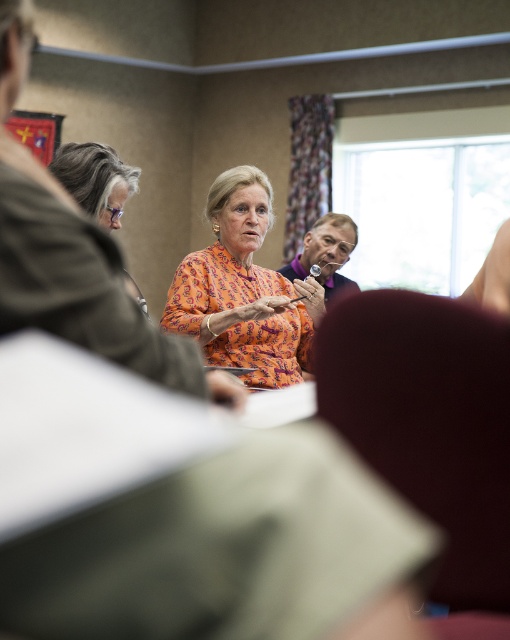
Looking at this image, based on the scene description, can you determine if the orange printed blouse at center is wider than the gray hair at left?

The orange printed blouse at center is wider than the gray hair at left according to the description.

Based on the photo, you are standing in front of the table where the group is seated. There is a point at coordinates (241, 289). Which object is located at that point?

The orange printed blouse at center is located at point (241, 289).

You are a photographer standing at the back of the room. You want to take a photo that includes both the orange printed blouse at center and the gray hair at left. Given that your camera has a maximum focus range of 25 inches, will you be able to capture both subjects clearly in focus?

The orange printed blouse at center is 27.39 inches away from gray hair at left. Since the distance between them exceeds the camera maximum focus range of 25 inches, you will not be able to capture both subjects clearly in focus.